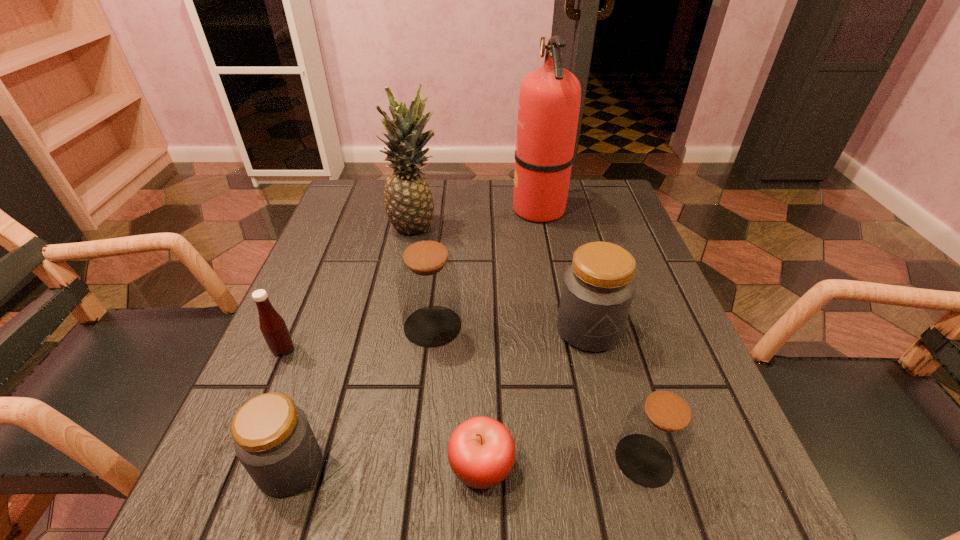
Locate an element on the screen. Image resolution: width=960 pixels, height=540 pixels. Tabasco sauce located at the left edge is located at coordinates (273, 327).

Find the location of a particular element. jar situated at the left edge is located at coordinates [x=273, y=440].

Where is `object at the far left corner`? This screenshot has width=960, height=540. object at the far left corner is located at coordinates (409, 205).

The image size is (960, 540). In order to click on object located in the near left corner section of the desktop in this screenshot , I will do `click(273, 440)`.

Locate an element on the screen. The image size is (960, 540). object that is at the near right corner is located at coordinates (658, 432).

This screenshot has width=960, height=540. Identify the location of free region at the far edge of the desktop. (467, 185).

Locate an element on the screen. free spot at the near edge of the desktop is located at coordinates (348, 515).

This screenshot has width=960, height=540. Identify the location of vacant space at the left edge of the desktop. (365, 267).

Image resolution: width=960 pixels, height=540 pixels. What are the coordinates of `blank space at the right edge of the desktop` in the screenshot? It's located at (682, 345).

You are a GUI agent. You are given a task and a screenshot of the screen. Output one action in this format:
    pyautogui.click(x=<x>, y=<y>)
    Task: Click on the vacant space at the far left corner
    
    Given the screenshot: What is the action you would take?
    pyautogui.click(x=387, y=218)